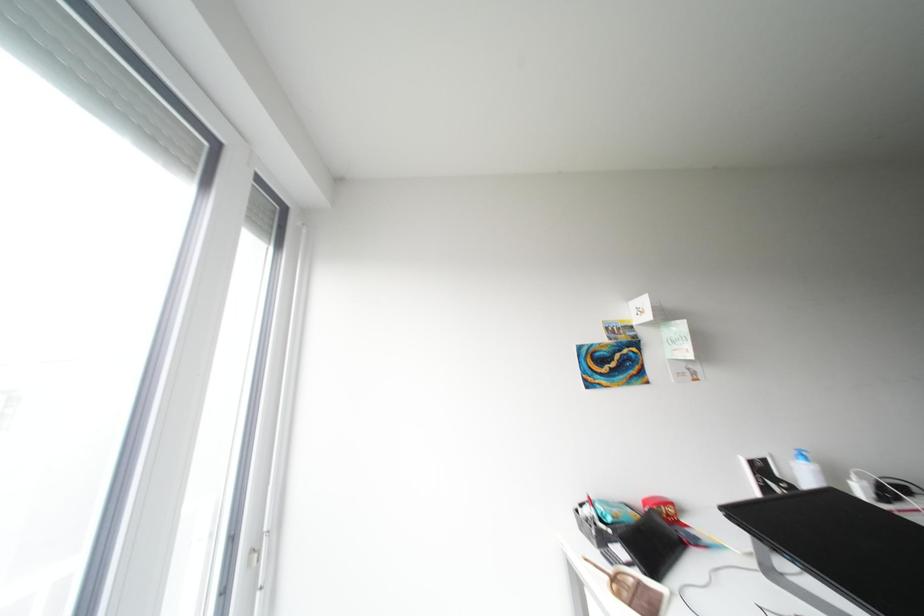
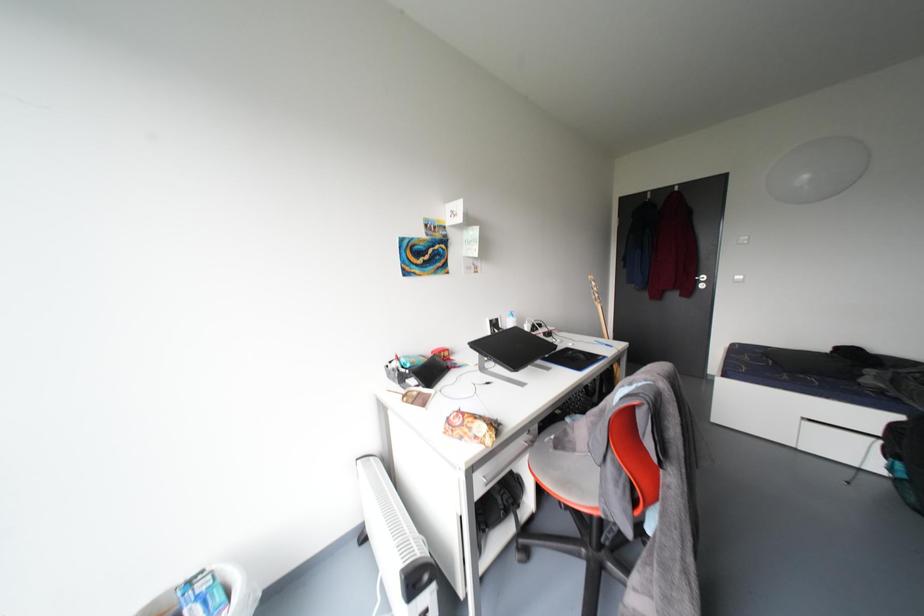
How did the camera likely rotate?

The camera's rotation is toward right-down.